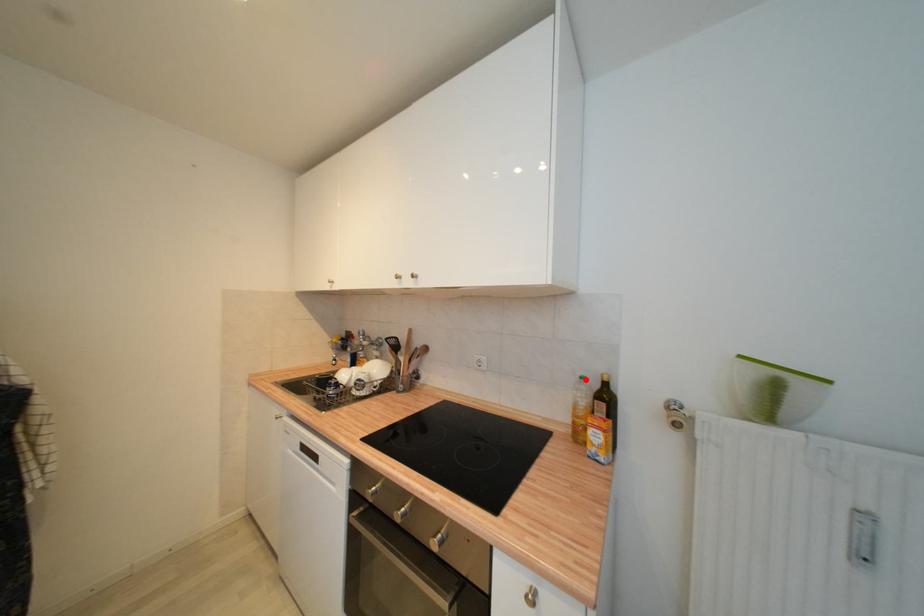
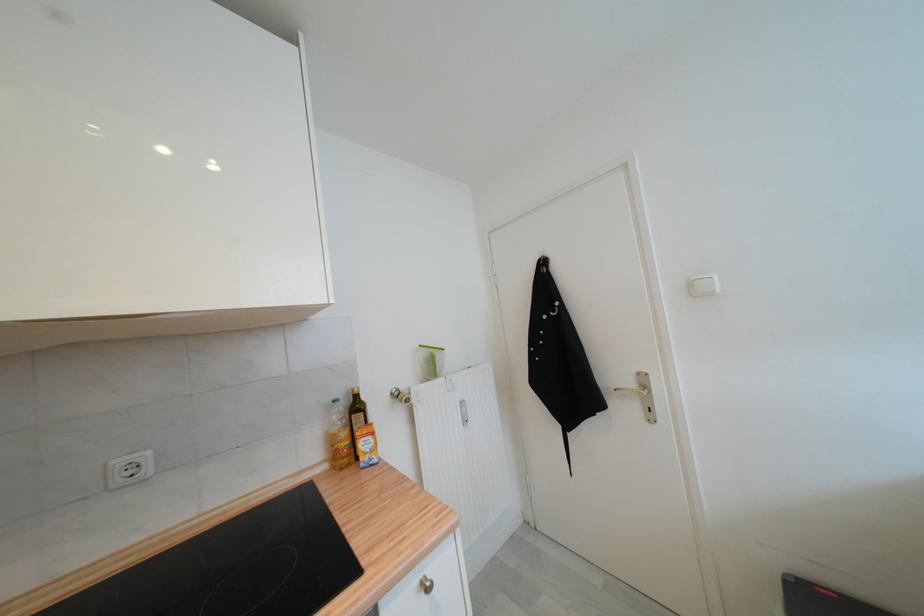
Locate, in the second image, the point that corresponds to the highlighted location in the first image.

(339, 403)